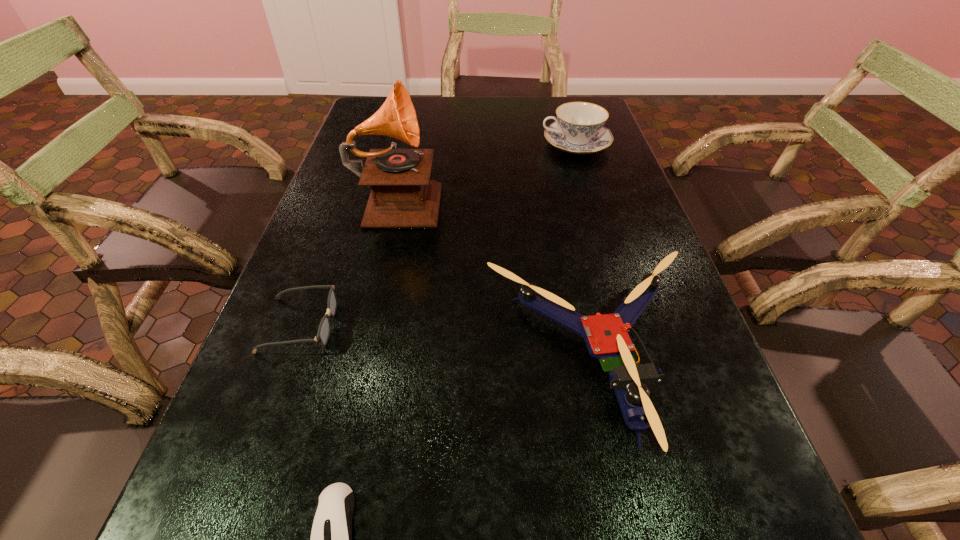
The height and width of the screenshot is (540, 960). I want to click on free spot that satisfies the following two spatial constraints: 1. on the face of the drone; 2. on the right side of the second shortest object, so click(288, 358).

You are a GUI agent. You are given a task and a screenshot of the screen. Output one action in this format:
    pyautogui.click(x=<x>, y=<y>)
    Task: Click on the free space that satisfies the following two spatial constraints: 1. on the horn of the second farthest object; 2. on the left side of the drone
    
    Given the screenshot: What is the action you would take?
    pyautogui.click(x=362, y=358)

This screenshot has height=540, width=960. What are the coordinates of `vacant point that satisfies the following two spatial constraints: 1. on the horn of the tallest object; 2. on the left side of the drone` in the screenshot? It's located at (362, 358).

This screenshot has width=960, height=540. I want to click on vacant area that satisfies the following two spatial constraints: 1. on the horn of the drone; 2. on the right side of the second farthest object, so click(x=362, y=358).

This screenshot has width=960, height=540. In order to click on vacant point that satisfies the following two spatial constraints: 1. on the horn of the drone; 2. on the right side of the fourth nearest object in this screenshot , I will do `click(362, 358)`.